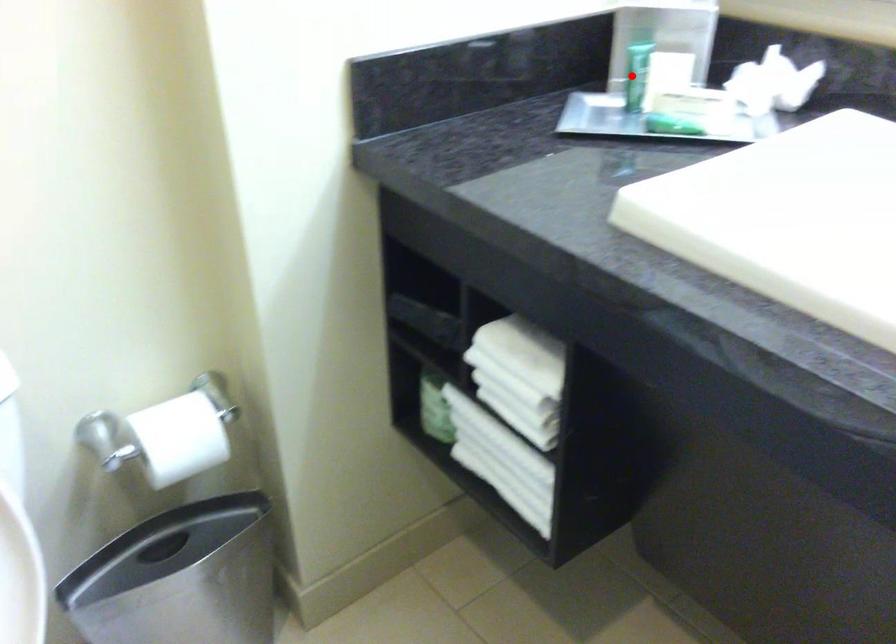
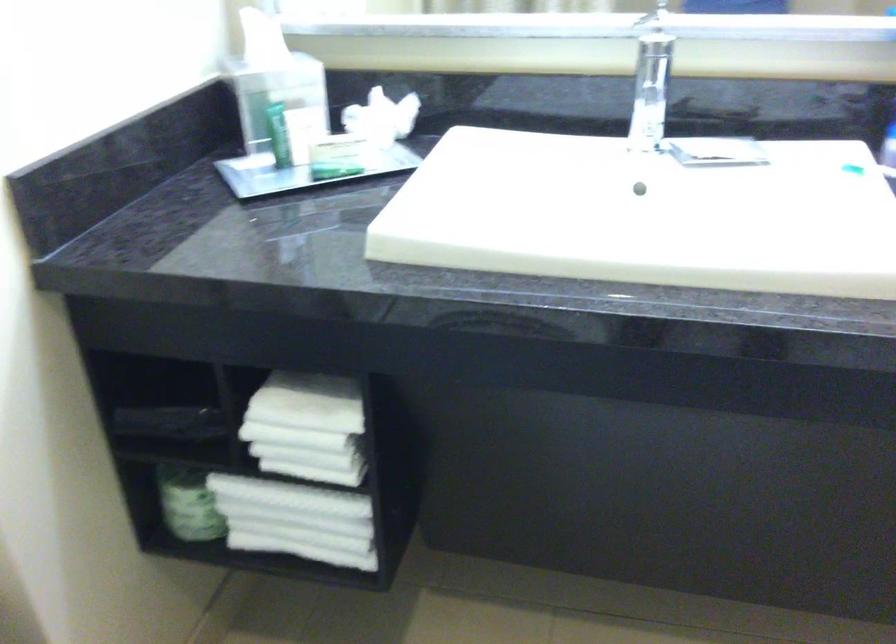
Find the pixel in the second image that matches the highlighted location in the first image.

(279, 134)